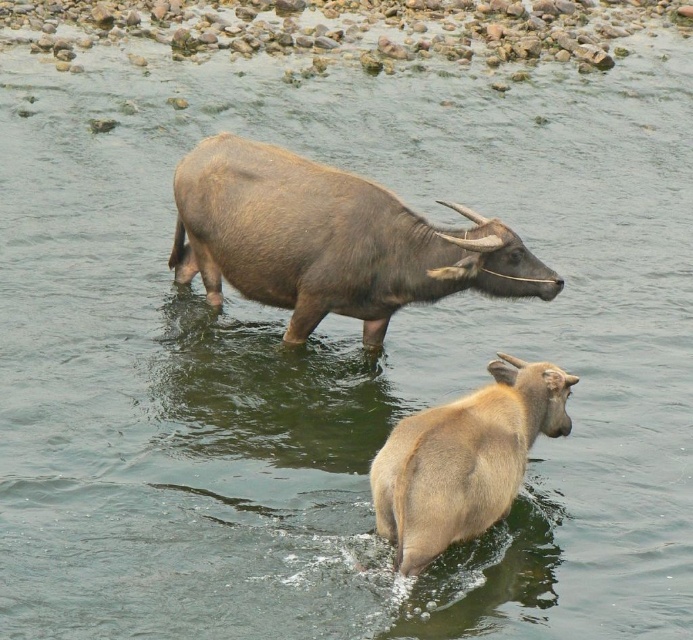
You are a farmer observing the brown matte bison at center and the light brown matte yak at center in the water. Which animal has a greater height?

The brown matte bison at center is taller than the light brown matte yak at center.

You are a photographer trying to capture both the brown matte bison at center and the light brown matte yak at center in the same frame. Based on their positions, which animal should you focus on first to ensure both are in focus?

The light brown matte yak at center is behind the brown matte bison at center, so you should focus on the brown matte bison at center first to ensure both are in focus.